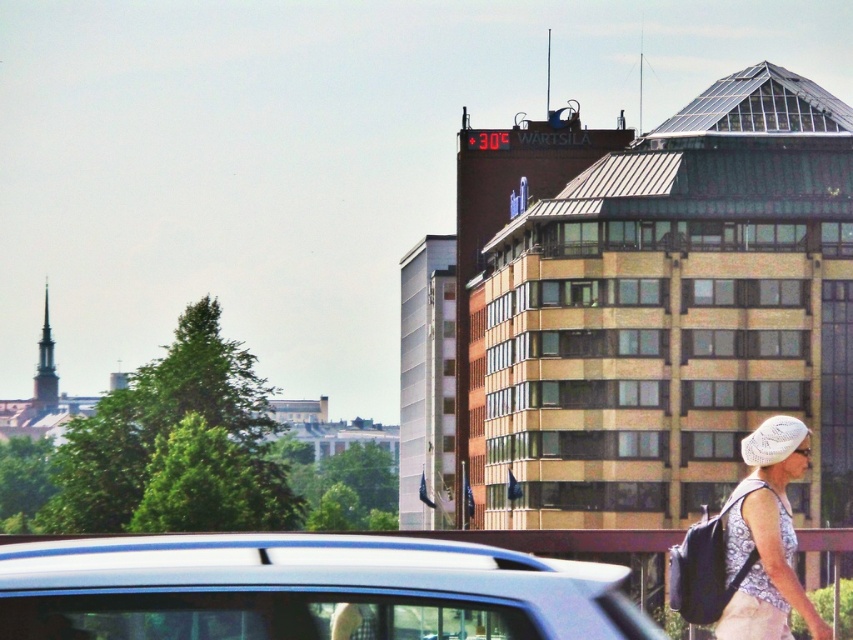
You are standing in the urban scene and want to determine which of the two points, point (426, 593) or point (764, 572), is nearer to you. Based on the scene description, which point is closer?

Point (426, 593) is closer to the camera than point (764, 572), so it is the nearer one.

You are a pedestrian standing at the crosswalk and see the metallic blue car at lower center and the white lace hat at lower right. Which object is closer to you?

The metallic blue car at lower center is closer to you because it is positioned over the white lace hat at lower right, indicating it is in front of it.

You are a pedestrian standing at the crosswalk and see the metallic blue car at lower center and the white lace hat at lower right. Which object is closer to you?

The metallic blue car at lower center is smaller than the white lace hat at lower right, which indicates it is farther away. Therefore, the white lace hat at lower right is closer to you.